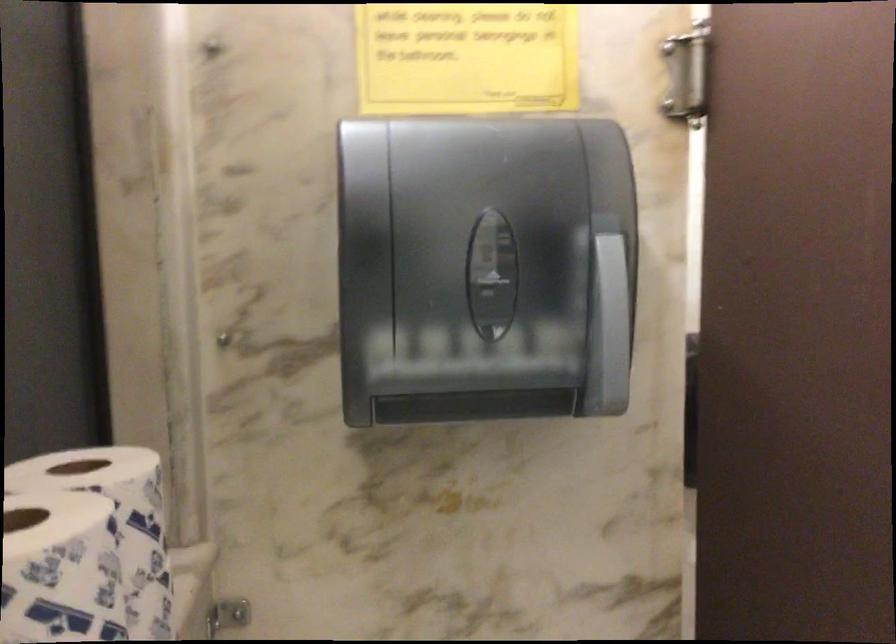
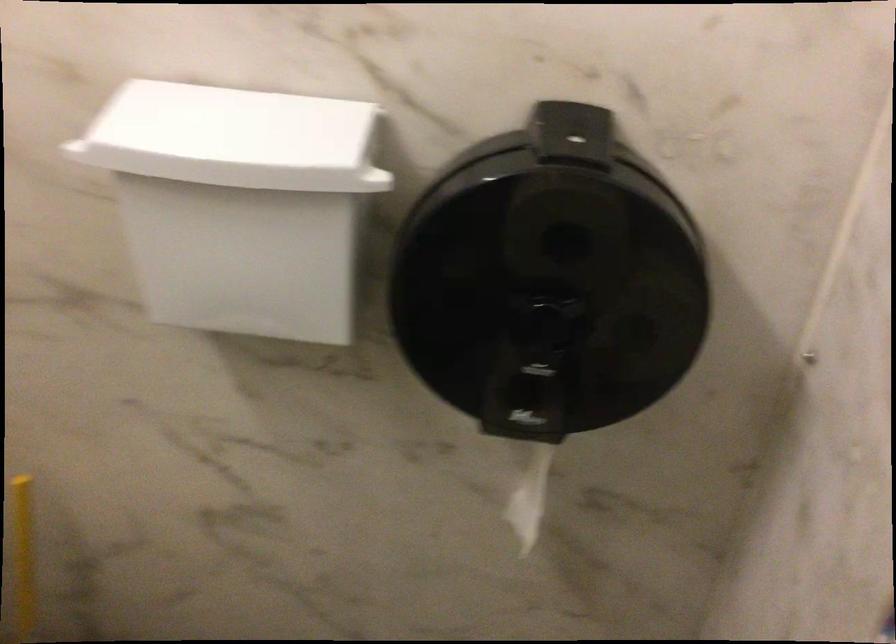
From the picture: What movement of the cameraman would produce the second image?

The cameraman moved toward right, forward.